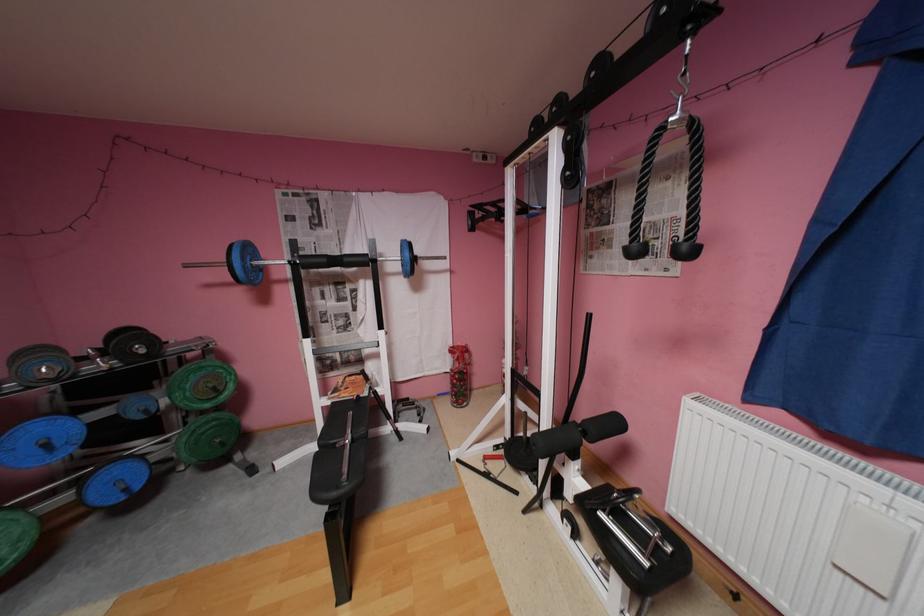
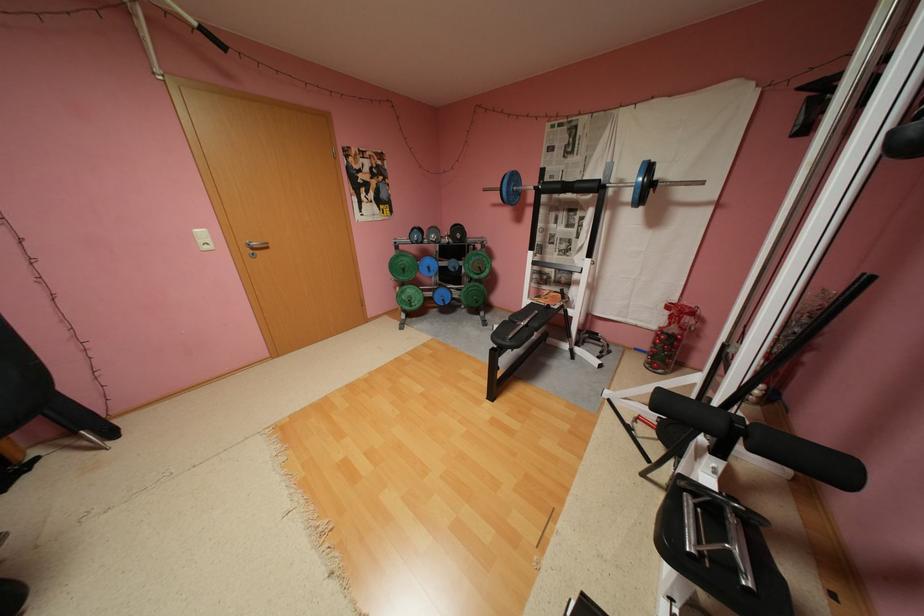
In the second image, find the point that corresponds to point 355,259 in the first image.

(586, 185)